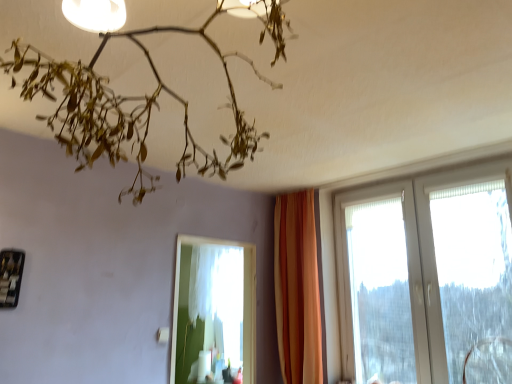
Question: Can you confirm if transparent plastic swivel chair at lower right is shorter than white sheer curtain at center?

Choices:
 (A) no
 (B) yes

Answer: (B)

Question: From the image's perspective, is transparent plastic swivel chair at lower right located above white sheer curtain at center?

Choices:
 (A) yes
 (B) no

Answer: (B)

Question: Is transparent plastic swivel chair at lower right to the right of white sheer curtain at center from the viewer's perspective?

Choices:
 (A) yes
 (B) no

Answer: (A)

Question: Can you confirm if transparent plastic swivel chair at lower right is bigger than white sheer curtain at center?

Choices:
 (A) yes
 (B) no

Answer: (B)

Question: From a real-world perspective, is transparent plastic swivel chair at lower right positioned under white sheer curtain at center based on gravity?

Choices:
 (A) no
 (B) yes

Answer: (B)

Question: From their relative heights in the image, would you say white plastic window at right is taller or shorter than orange fabric curtain at center?

Choices:
 (A) short
 (B) tall

Answer: (A)

Question: Based on their sizes in the image, would you say white plastic window at right is bigger or smaller than orange fabric curtain at center?

Choices:
 (A) big
 (B) small

Answer: (A)

Question: Considering their positions, is white plastic window at right located in front of or behind orange fabric curtain at center?

Choices:
 (A) front
 (B) behind

Answer: (A)

Question: Do you think white plastic window at right is within orange fabric curtain at center, or outside of it?

Choices:
 (A) inside
 (B) outside

Answer: (B)

Question: Considering the positions of transparent plastic swivel chair at lower right and white plastic window at right in the image, is transparent plastic swivel chair at lower right taller or shorter than white plastic window at right?

Choices:
 (A) short
 (B) tall

Answer: (A)

Question: Considering their positions, is transparent plastic swivel chair at lower right located in front of or behind white plastic window at right?

Choices:
 (A) behind
 (B) front

Answer: (B)

Question: Is transparent plastic swivel chair at lower right spatially inside white plastic window at right, or outside of it?

Choices:
 (A) outside
 (B) inside

Answer: (A)

Question: In terms of width, does transparent plastic swivel chair at lower right look wider or thinner when compared to white plastic window at right?

Choices:
 (A) wide
 (B) thin

Answer: (A)

Question: Is point (37, 84) closer or farther from the camera than point (185, 311)?

Choices:
 (A) farther
 (B) closer

Answer: (B)

Question: Relative to white sheer curtain at center, is matte white lamp at upper center in front or behind?

Choices:
 (A) behind
 (B) front

Answer: (B)